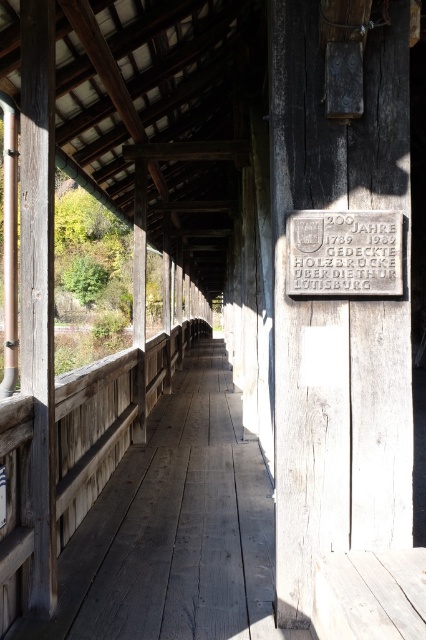
You are a painter who needs to decide which surface to paint first. The weathered wood porch at center and the gray stone plaque at center are both in need of touchup. Which one requires more paint due to its size?

The weathered wood porch at center requires more paint because it is larger in size than the gray stone plaque at center.

You are a tourist visiting the bridge and want to take a photo of both the weathered wood sign at right and the gray stone plaque at center. Since you want to include both in the frame, which object should you position closer to the camera to ensure both are visible?

To include both the weathered wood sign at right and the gray stone plaque at center in the frame, you should position the gray stone plaque at center closer to the camera. Since the weathered wood sign at right is larger in size, moving the smaller gray stone plaque at center forward will help balance their sizes in the photo.